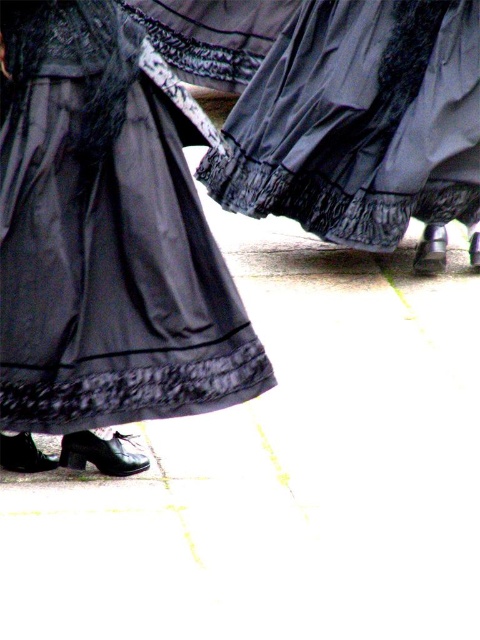
Question: Is satin black dress at lower left to the right of matte black skirt at center from the viewer's perspective?

Choices:
 (A) yes
 (B) no

Answer: (B)

Question: Which point is farther from the camera taking this photo?

Choices:
 (A) (347, 108)
 (B) (21, 429)

Answer: (A)

Question: Which point is farther to the camera?

Choices:
 (A) (35, 268)
 (B) (352, 163)

Answer: (B)

Question: Does satin black dress at lower left appear on the right side of matte black skirt at center?

Choices:
 (A) no
 (B) yes

Answer: (A)

Question: From the image, what is the correct spatial relationship of satin black dress at lower left in relation to matte black skirt at center?

Choices:
 (A) left
 (B) right

Answer: (A)

Question: Among these objects, which one is nearest to the camera?

Choices:
 (A) matte black skirt at center
 (B) satin black dress at lower left

Answer: (B)